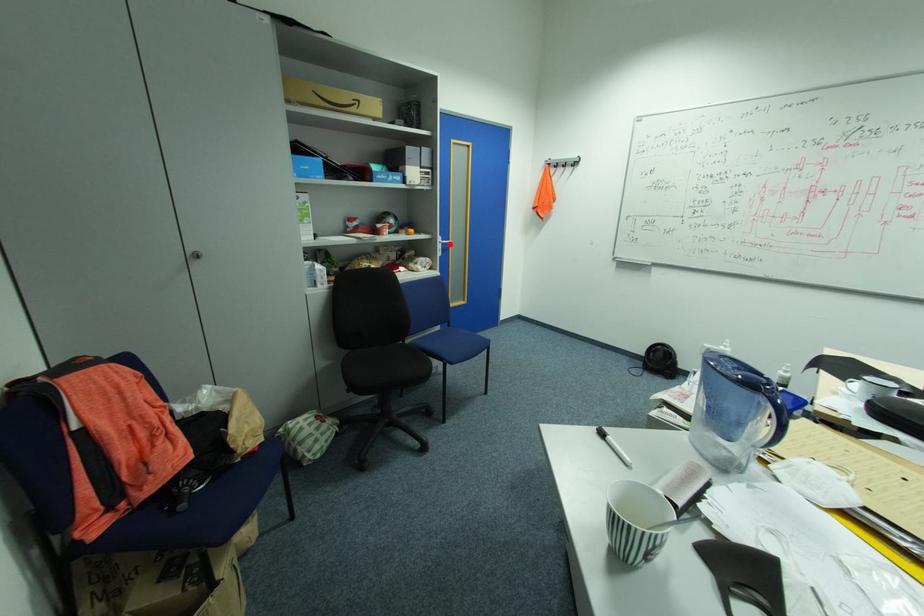
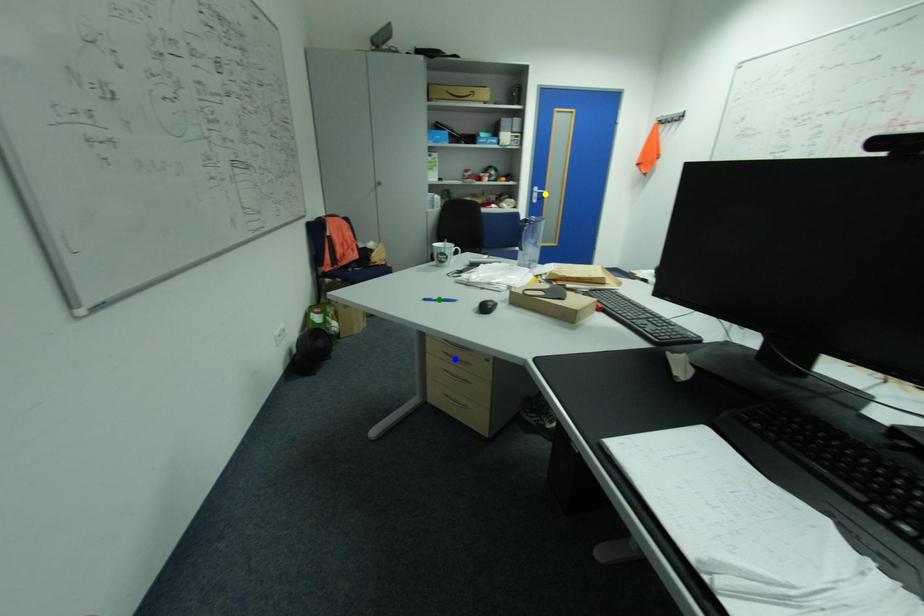
Question: I am providing you with two images of the same scene from different viewpoints. A red point is marked on the first image. You are given multiple points on the second image. Which point in image 2 represents the same 3d spot as the red point in image 1?

Choices:
 (A) green point
 (B) yellow point
 (C) blue point

Answer: (B)